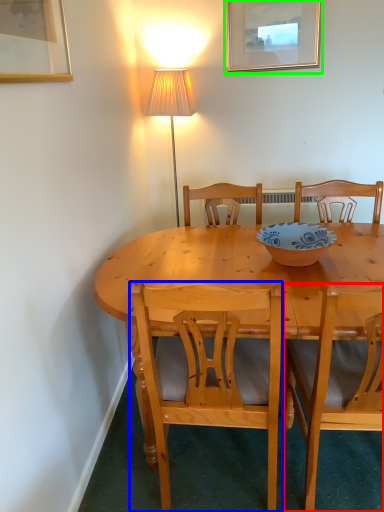
Question: Based on their relative distances, which object is nearer to chair (highlighted by a red box)? Choose from chair (highlighted by a blue box) and picture frame (highlighted by a green box).

Choices:
 (A) chair
 (B) picture frame

Answer: (A)